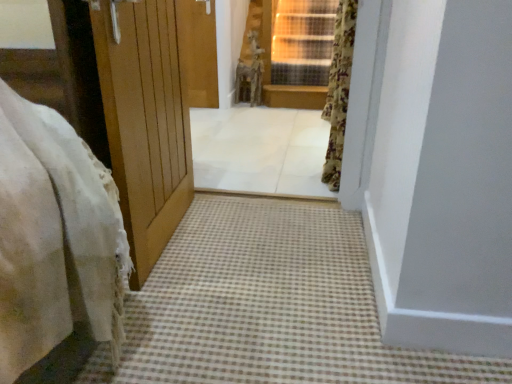
Question: Choose the correct answer: Is white tile floor at center inside brown checkered carpet at lower center or outside it?

Choices:
 (A) inside
 (B) outside

Answer: (B)

Question: Based on their sizes in the image, would you say white tile floor at center is bigger or smaller than brown checkered carpet at lower center?

Choices:
 (A) small
 (B) big

Answer: (B)

Question: Based on their relative distances, which object is nearer to the white tile floor at center?

Choices:
 (A) floral fabric curtain at upper right
 (B) brown checkered carpet at lower center

Answer: (A)

Question: Which of these objects is positioned farthest from the white tile floor at center?

Choices:
 (A) brown checkered carpet at lower center
 (B) floral fabric curtain at upper right

Answer: (A)